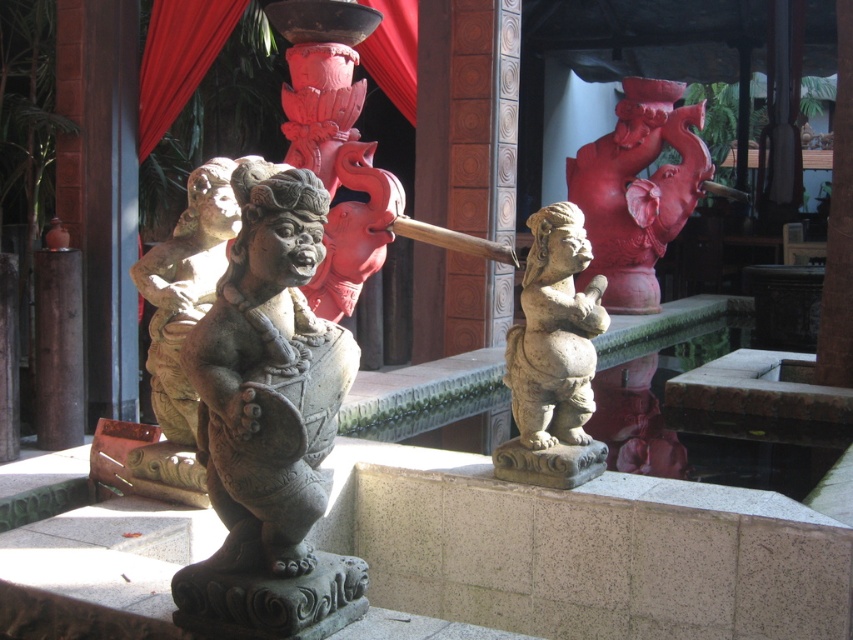
Measure the distance between gray stone statue at center and camera.

3.69 meters

Is gray stone statue at center shorter than stone statue at center?

No.

Does point (212, 595) come farther from viewer compared to point (508, 355)?

No, it is not.

Where is `gray stone statue at center`? The width and height of the screenshot is (853, 640). gray stone statue at center is located at coordinates (270, 422).